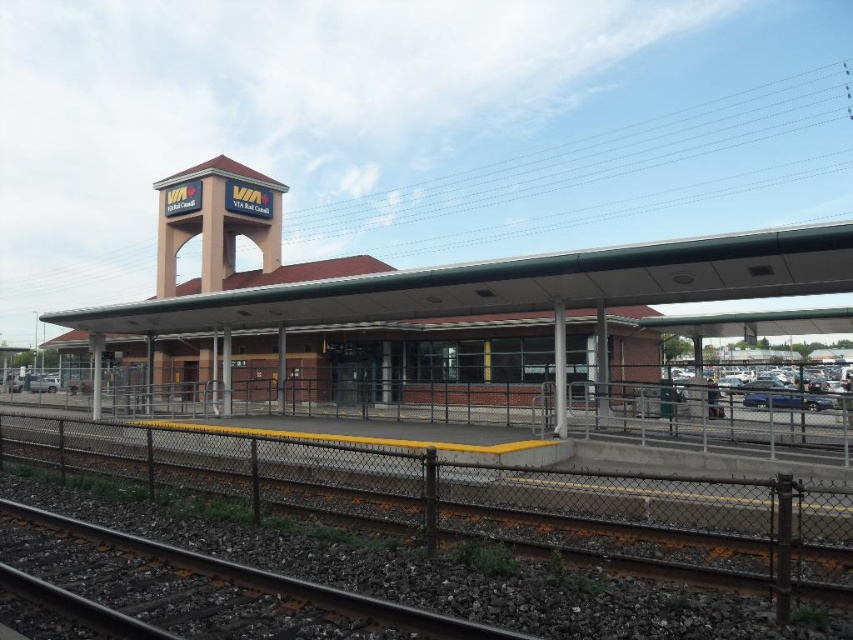
Does point (682, 518) come in front of point (71, 525)?

That is False.

Describe the element at coordinates (483, 500) in the screenshot. The height and width of the screenshot is (640, 853). I see `metallic track at lower left` at that location.

Locate an element on the screen. The height and width of the screenshot is (640, 853). metallic track at lower left is located at coordinates (483, 500).